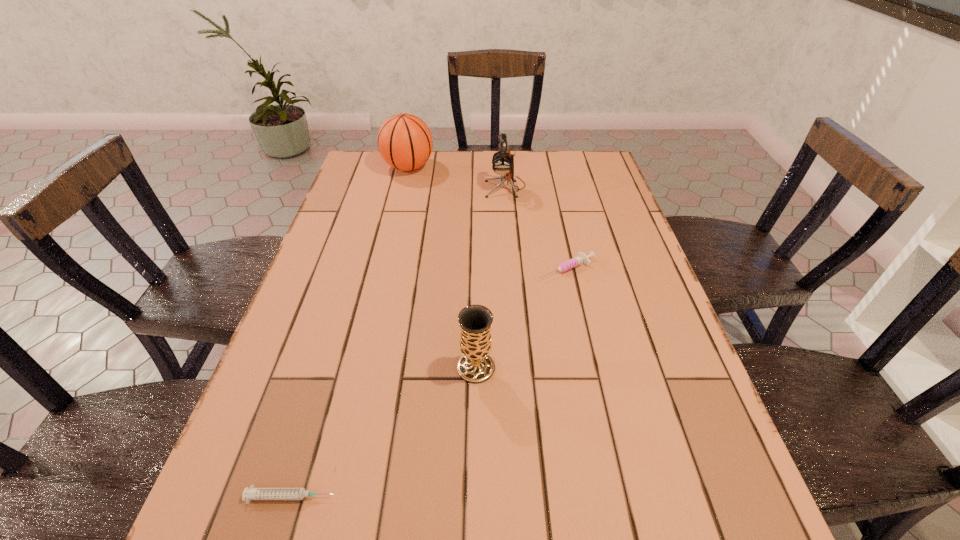
The width and height of the screenshot is (960, 540). I want to click on empty location between the farther syringe and the earphone, so click(536, 228).

Locate an element on the screen. The height and width of the screenshot is (540, 960). vacant space that is in between the basketball and the shortest object is located at coordinates (349, 332).

At what (x,y) coordinates should I click in order to perform the action: click on free space between the farther syringe and the basketball. Please return your answer as a coordinate pair (x, y). Looking at the image, I should click on (488, 218).

Identify the location of the fourth closest object to the left syringe. (405, 142).

Locate which object ranks second in proximity to the basketball. Please provide its 2D coordinates. Your answer should be formatted as a tuple, i.e. [(x, y)], where the tuple contains the x and y coordinates of a point satisfying the conditions above.

[(581, 258)]

Image resolution: width=960 pixels, height=540 pixels. Identify the location of free space in the image that satisfies the following two spatial constraints: 1. on the front side of the third tallest object; 2. at the needle end of the shorter syringe. (475, 497).

The width and height of the screenshot is (960, 540). I want to click on free space that satisfies the following two spatial constraints: 1. on the front side of the earphone; 2. at the needle end of the left syringe, so click(529, 497).

You are a GUI agent. You are given a task and a screenshot of the screen. Output one action in this format:
    pyautogui.click(x=<x>, y=<y>)
    Task: Click on the free space that satisfies the following two spatial constraints: 1. on the back side of the earphone; 2. on the left side of the third shortest object
    
    Given the screenshot: What is the action you would take?
    pyautogui.click(x=477, y=187)

The image size is (960, 540). Find the location of `free spot that satisfies the following two spatial constraints: 1. on the front side of the basketball; 2. at the needle end of the left syringe`. free spot that satisfies the following two spatial constraints: 1. on the front side of the basketball; 2. at the needle end of the left syringe is located at coordinates (330, 497).